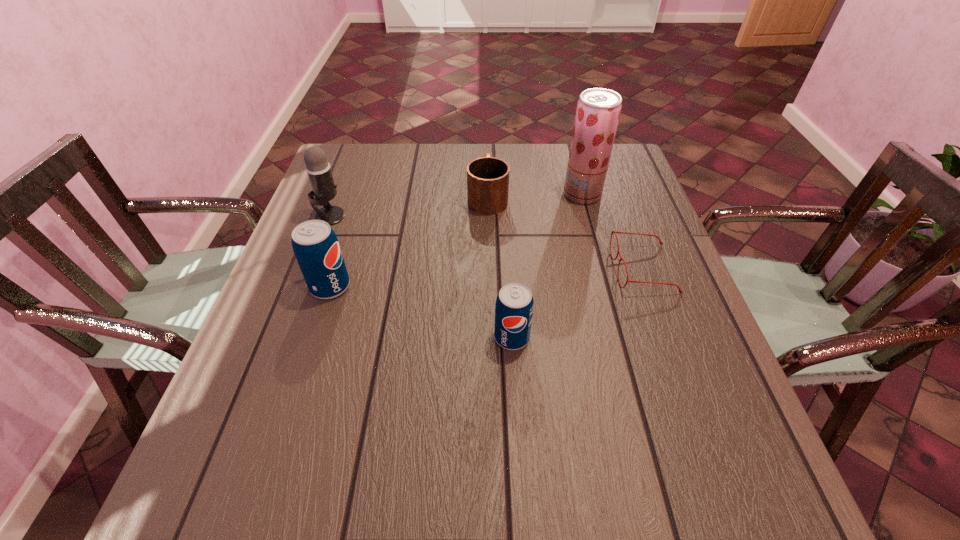
Locate an element on the screen. Image resolution: width=960 pixels, height=540 pixels. pop located in the left edge section of the desktop is located at coordinates (316, 247).

This screenshot has width=960, height=540. I want to click on microphone located at the left edge, so click(x=318, y=168).

Find the location of `fruit juice that is at the right edge`. fruit juice that is at the right edge is located at coordinates (598, 110).

The width and height of the screenshot is (960, 540). Find the location of `spectacles at the right edge`. spectacles at the right edge is located at coordinates (615, 232).

The height and width of the screenshot is (540, 960). I want to click on object that is at the far right corner, so click(x=598, y=110).

I want to click on free space at the far edge of the desktop, so click(x=548, y=156).

I want to click on vacant area at the near edge, so click(x=564, y=439).

Locate an element on the screen. This screenshot has height=540, width=960. vacant region at the left edge of the desktop is located at coordinates (365, 212).

Where is `vacant space at the right edge of the desktop`? The width and height of the screenshot is (960, 540). vacant space at the right edge of the desktop is located at coordinates (714, 356).

Identify the location of vacant space at the far left corner. (363, 149).